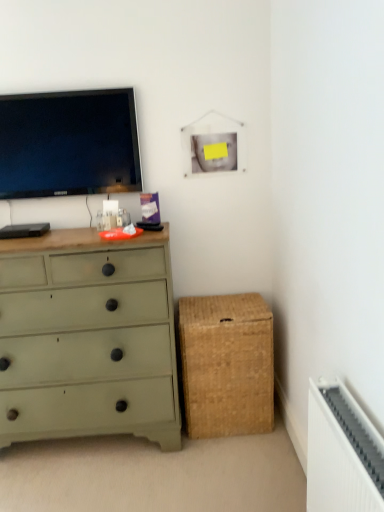
At what (x,y) coordinates should I click in order to perform the action: click on matte black tv at upper left. Please return your answer as a coordinate pair (x, y). The height and width of the screenshot is (512, 384). Looking at the image, I should click on (69, 144).

Describe the element at coordinates (87, 338) in the screenshot. I see `green painted wood chest of drawers at left` at that location.

Describe the element at coordinates (227, 365) in the screenshot. I see `braided wicker storage box at lower right` at that location.

What are the coordinates of `matte black tv at upper left` in the screenshot? It's located at (69, 144).

Is matte black tv at upper left touching braided wicker storage box at lower right?

No, matte black tv at upper left is not beside braided wicker storage box at lower right.

Which is more to the right, matte black tv at upper left or braided wicker storage box at lower right?

From the viewer's perspective, braided wicker storage box at lower right appears more on the right side.

Does matte black tv at upper left have a lesser height compared to braided wicker storage box at lower right?

Yes, matte black tv at upper left is shorter than braided wicker storage box at lower right.

Can we say matte black tv at upper left lies outside braided wicker storage box at lower right?

Indeed, matte black tv at upper left is completely outside braided wicker storage box at lower right.

Consider the image. Which point is more forward, (139, 422) or (2, 146)?

The point (139, 422) is more forward.

Is green painted wood chest of drawers at left located outside matte black tv at upper left?

green painted wood chest of drawers at left is positioned outside matte black tv at upper left.

Could you tell me if green painted wood chest of drawers at left is turned towards matte black tv at upper left?

No, green painted wood chest of drawers at left is not aimed at matte black tv at upper left.

Does green painted wood chest of drawers at left appear on the right side of braided wicker storage box at lower right?

In fact, green painted wood chest of drawers at left is to the left of braided wicker storage box at lower right.

Is point (124, 357) positioned behind point (267, 379)?

No, it is in front of (267, 379).

In the scene shown: Choose the correct answer: Is green painted wood chest of drawers at left inside braided wicker storage box at lower right or outside it?

green painted wood chest of drawers at left exists outside the volume of braided wicker storage box at lower right.

Can green painted wood chest of drawers at left be found inside braided wicker storage box at lower right?

No, braided wicker storage box at lower right does not contain green painted wood chest of drawers at left.

Is braided wicker storage box at lower right oriented towards green painted wood chest of drawers at left?

No, braided wicker storage box at lower right is not oriented towards green painted wood chest of drawers at left.

Can you confirm if braided wicker storage box at lower right is taller than green painted wood chest of drawers at left?

Incorrect, the height of braided wicker storage box at lower right is not larger of that of green painted wood chest of drawers at left.

In the scene shown: Looking at their sizes, would you say matte black tv at upper left is wider or thinner than green painted wood chest of drawers at left?

Clearly, matte black tv at upper left has less width compared to green painted wood chest of drawers at left.

Does matte black tv at upper left come in front of green painted wood chest of drawers at left?

No.

How much distance is there between matte black tv at upper left and green painted wood chest of drawers at left?

matte black tv at upper left and green painted wood chest of drawers at left are 29.90 inches apart from each other.

From the image's perspective, does matte black tv at upper left appear lower than green painted wood chest of drawers at left?

Incorrect, from the image's perspective, matte black tv at upper left is higher than green painted wood chest of drawers at left.

Which object is positioned more to the right, braided wicker storage box at lower right or matte black tv at upper left?

braided wicker storage box at lower right.

Looking at this image, from a real-world perspective, is braided wicker storage box at lower right located higher than matte black tv at upper left?

No, from a real-world perspective, braided wicker storage box at lower right is not over matte black tv at upper left

Considering the sizes of objects braided wicker storage box at lower right and matte black tv at upper left in the image provided, who is wider, braided wicker storage box at lower right or matte black tv at upper left?

braided wicker storage box at lower right.

This screenshot has height=512, width=384. In order to click on television on the left of the braided wicker storage box at lower right in this screenshot , I will do `click(69, 144)`.

Where is `the chest of drawers in front of the matte black tv at upper left`? The width and height of the screenshot is (384, 512). the chest of drawers in front of the matte black tv at upper left is located at coordinates pyautogui.click(x=87, y=338).

When comparing their distances from braided wicker storage box at lower right, does green painted wood chest of drawers at left or matte black tv at upper left seem further?

The object further to braided wicker storage box at lower right is matte black tv at upper left.

Considering their positions, is matte black tv at upper left positioned further to green painted wood chest of drawers at left than braided wicker storage box at lower right?

matte black tv at upper left lies further to green painted wood chest of drawers at left than the other object.

Based on their spatial positions, is braided wicker storage box at lower right or green painted wood chest of drawers at left closer to matte black tv at upper left?

green painted wood chest of drawers at left.

Considering their positions, is green painted wood chest of drawers at left positioned further to matte black tv at upper left than braided wicker storage box at lower right?

braided wicker storage box at lower right is further to matte black tv at upper left.

Estimate the real-world distances between objects in this image. Which object is further from green painted wood chest of drawers at left, braided wicker storage box at lower right or matte black tv at upper left?

Based on the image, matte black tv at upper left appears to be further to green painted wood chest of drawers at left.

Considering their positions, is matte black tv at upper left positioned further to braided wicker storage box at lower right than green painted wood chest of drawers at left?

matte black tv at upper left is positioned further to the anchor braided wicker storage box at lower right.

Identify the location of chest of drawers between matte black tv at upper left and braided wicker storage box at lower right from top to bottom. (87, 338).